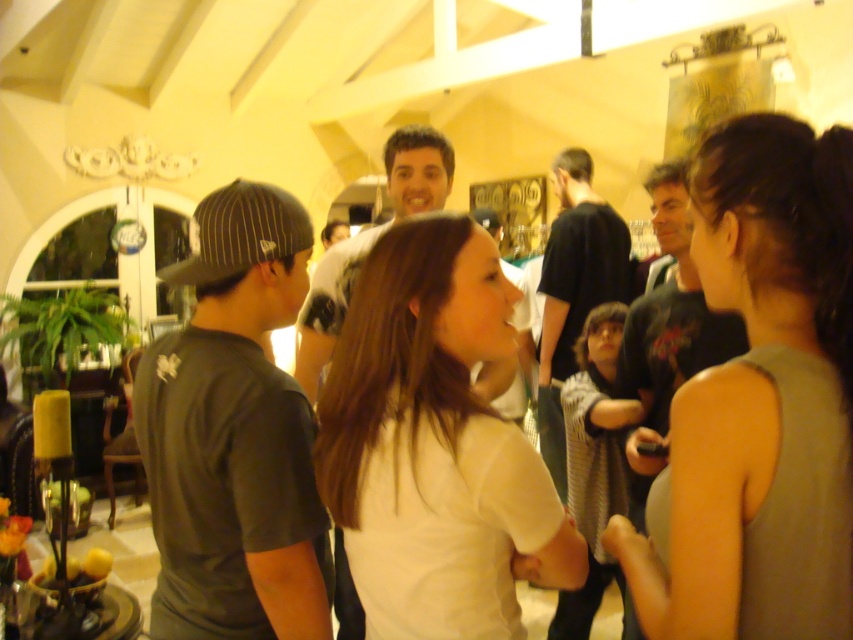
Can you confirm if dark green t-shirt at center is positioned to the left of dark gray shirt at center?

Indeed, dark green t-shirt at center is positioned on the left side of dark gray shirt at center.

Describe the element at coordinates (234, 435) in the screenshot. This screenshot has height=640, width=853. I see `dark green t-shirt at center` at that location.

Consider the image. Who is more forward, (x=299, y=502) or (x=581, y=234)?

Point (x=299, y=502) is in front.

Locate an element on the screen. This screenshot has width=853, height=640. dark green t-shirt at center is located at coordinates (234, 435).

Is point (265, 480) behind point (428, 364)?

Yes.

Can you confirm if dark green t-shirt at center is smaller than white matte shirt at center?

No, dark green t-shirt at center is not smaller than white matte shirt at center.

Does point (163, 380) come behind point (468, 508)?

Yes, it is.

The image size is (853, 640). Identify the location of dark green t-shirt at center. (234, 435).

Is matte gray tank top at center positioned behind white matte shirt at center?

No, matte gray tank top at center is closer to the viewer.

Is point (834, 221) positioned after point (337, 452)?

No, (834, 221) is closer to viewer.

Identify the location of matte gray tank top at center. This screenshot has width=853, height=640. (759, 403).